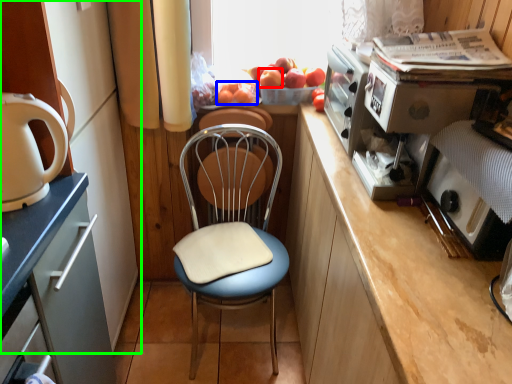
Question: Based on their relative distances, which object is nearer to apple (highlighted by a red box)? Choose from fruit (highlighted by a blue box) and cabinetry (highlighted by a green box).

Choices:
 (A) fruit
 (B) cabinetry

Answer: (A)